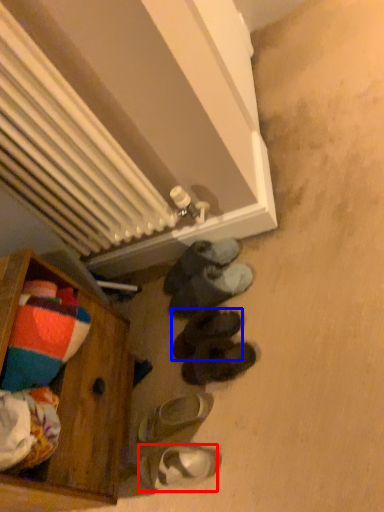
Question: Which of the following is the farthest to the observer, footwear (highlighted by a red box) or footwear (highlighted by a blue box)?

Choices:
 (A) footwear
 (B) footwear

Answer: (B)